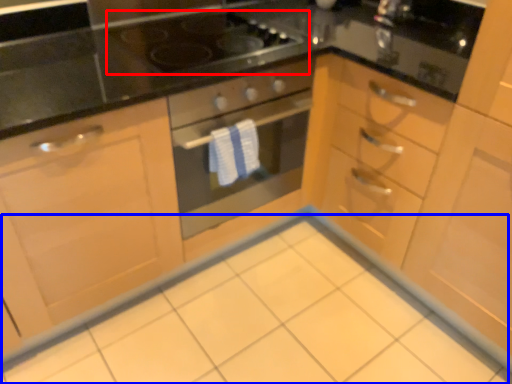
Question: Which object is closer to the camera taking this photo, gas stove (highlighted by a red box) or ceramic tile (highlighted by a blue box)?

Choices:
 (A) gas stove
 (B) ceramic tile

Answer: (B)